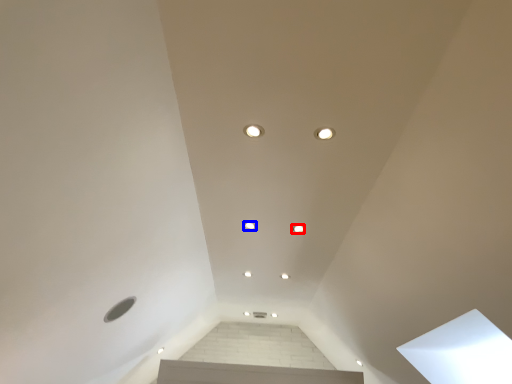
Question: Which of the following is the farthest to the observer, dot (highlighted by a red box) or dot (highlighted by a blue box)?

Choices:
 (A) dot
 (B) dot

Answer: (B)